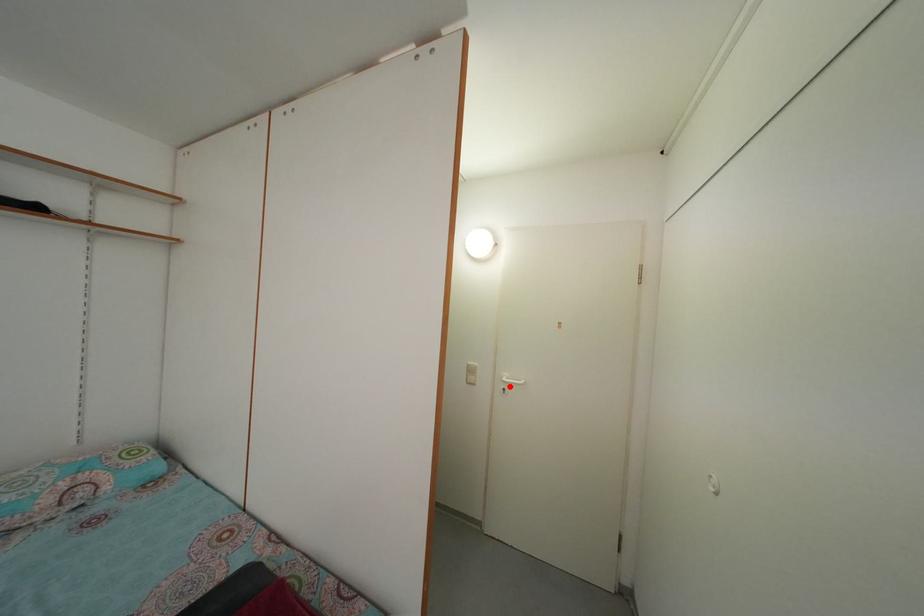
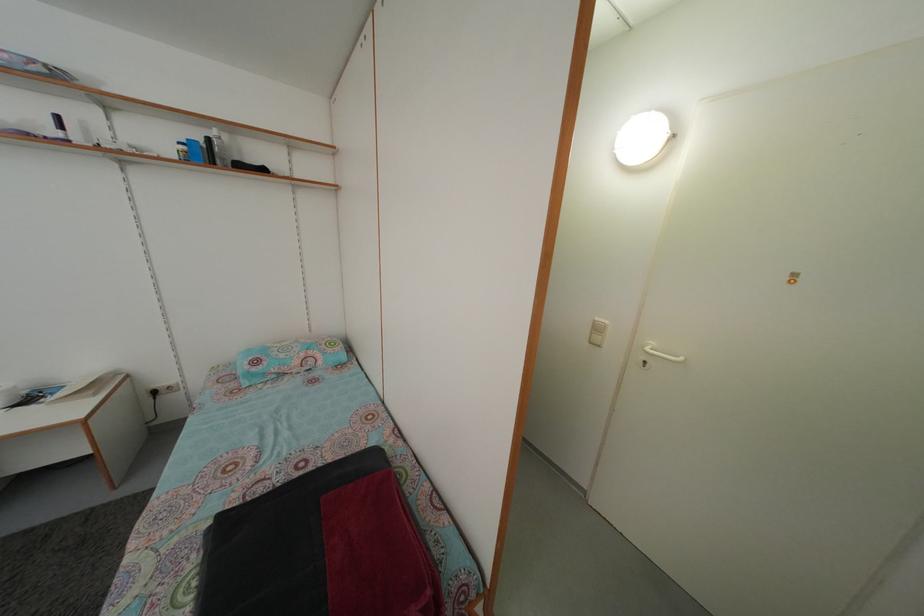
Question: I am providing you with two images of the same scene from different viewpoints. Given a red point in image1, look at the same physical point in image2. Is it:

Choices:
 (A) Closer to the viewpoint
 (B) Farther from the viewpoint

Answer: (A)